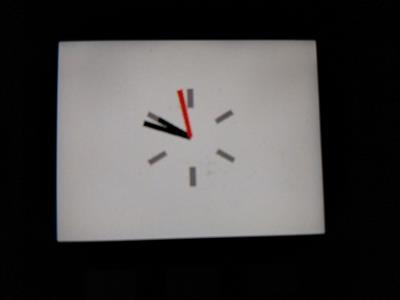
I want to click on upper left corner of white clock, so click(x=59, y=42).